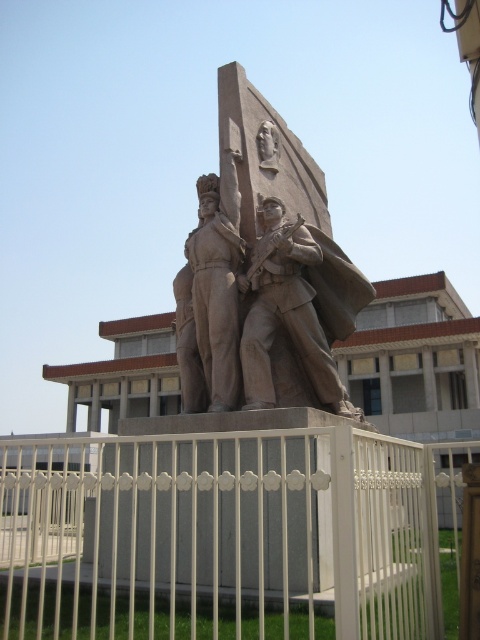
You are a photographer trying to capture the brown stone statue at center without any obstructions. Given that the white metal fence at center is in front of the statue, can you determine if the statue is mostly visible through the fence?

The white metal fence at center has a larger size compared to brown stone statue at center, so the statue may be mostly visible through the fence as the fence is bigger but not necessarily blocking the entire statue.

You are an artist trying to sketch the statue from the front. You notice the white metal fence at center and the brown stone statue at center in your view. Which object is wider in your field of view?

The white metal fence at center is wider than the brown stone statue at center, so the white metal fence at center appears wider in your field of view.